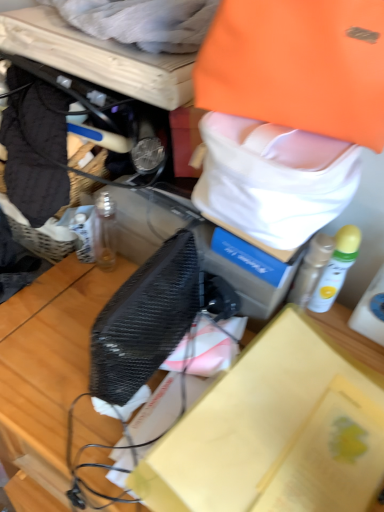
Question: Does white matte spray can at right, the 1th bottle in the right-to-left sequence, have a smaller size compared to orange fabric tote bag at upper right?

Choices:
 (A) no
 (B) yes

Answer: (B)

Question: From a real-world perspective, is white matte spray can at right, the 2th bottle when ordered from left to right, located beneath orange fabric tote bag at upper right?

Choices:
 (A) yes
 (B) no

Answer: (A)

Question: Are white matte spray can at right, the 1th bottle in the right-to-left sequence, and orange fabric tote bag at upper right beside each other?

Choices:
 (A) no
 (B) yes

Answer: (A)

Question: Can you confirm if white matte spray can at right, the 1th bottle in the right-to-left sequence, is positioned to the right of orange fabric tote bag at upper right?

Choices:
 (A) yes
 (B) no

Answer: (A)

Question: Is white matte spray can at right, the 2th bottle when ordered from left to right, shorter than orange fabric tote bag at upper right?

Choices:
 (A) yes
 (B) no

Answer: (B)

Question: From their relative heights in the image, would you say white cotton towel at upper center, which is counted as the 2th clothing, starting from the bottom, is taller or shorter than orange fabric tote bag at upper right?

Choices:
 (A) short
 (B) tall

Answer: (A)

Question: Considering their positions, is white cotton towel at upper center, placed as the 1th clothing when sorted from top to bottom, located in front of or behind orange fabric tote bag at upper right?

Choices:
 (A) behind
 (B) front

Answer: (A)

Question: Looking at their shapes, would you say white cotton towel at upper center, which ranks as the 1th clothing in left-to-right order, is wider or thinner than orange fabric tote bag at upper right?

Choices:
 (A) wide
 (B) thin

Answer: (B)

Question: Is point (170, 44) positioned closer to the camera than point (332, 197)?

Choices:
 (A) farther
 (B) closer

Answer: (A)

Question: In terms of width, does black mesh box at center look wider or thinner when compared to orange fabric tote bag at upper right?

Choices:
 (A) wide
 (B) thin

Answer: (A)

Question: Would you say black mesh box at center is inside or outside orange fabric tote bag at upper right?

Choices:
 (A) outside
 (B) inside

Answer: (A)

Question: Considering the relative positions of black mesh box at center and orange fabric tote bag at upper right in the image provided, is black mesh box at center to the left or to the right of orange fabric tote bag at upper right?

Choices:
 (A) left
 (B) right

Answer: (A)

Question: From the image's perspective, relative to orange fabric tote bag at upper right, is black mesh box at center above or below?

Choices:
 (A) above
 (B) below

Answer: (B)

Question: Considering the positions of orange fabric tote bag at upper right and black mesh box at center in the image, is orange fabric tote bag at upper right bigger or smaller than black mesh box at center?

Choices:
 (A) small
 (B) big

Answer: (B)

Question: From a real-world perspective, is orange fabric tote bag at upper right positioned above or below black mesh box at center?

Choices:
 (A) above
 (B) below

Answer: (A)